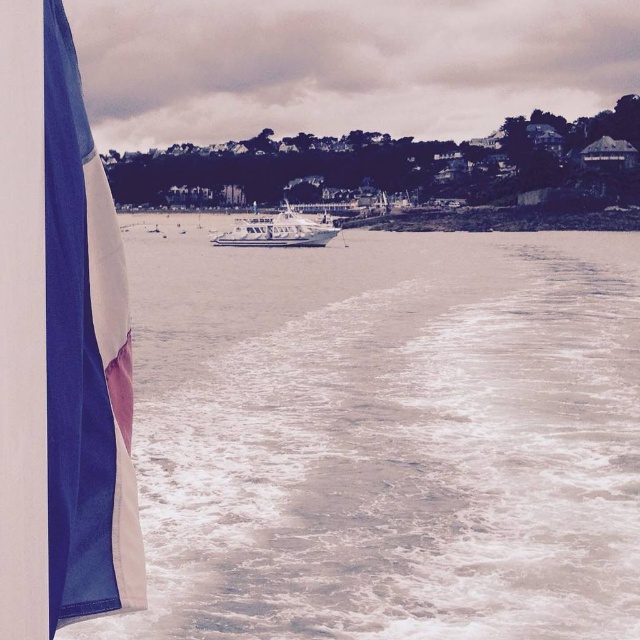
You are standing on the boat and looking at two points marked in the scene. Which point is closer to you? The points are point (132, 243) and point (260, 236).

Point (132, 243) is closer to you because it is further to the camera than point (260, 236).

You are standing on the deck of the boat and want to know how far you are from the point marked at coordinates point (584, 332). Can you determine the distance?

The distance between you and the point (584, 332) is 202.58 feet.

You are a sailor on a boat and want to know if you can safely navigate between the blue fabric flag at left and the white matte boat at center without hitting any obstacles. The boat you are on is 10 meters long. Can you fit through the space between them?

The distance between the blue fabric flag at left and the white matte boat at center is 98.07 meters, which is significantly wider than your boat length of 10 meters. Therefore, you can safely navigate through the space between them.